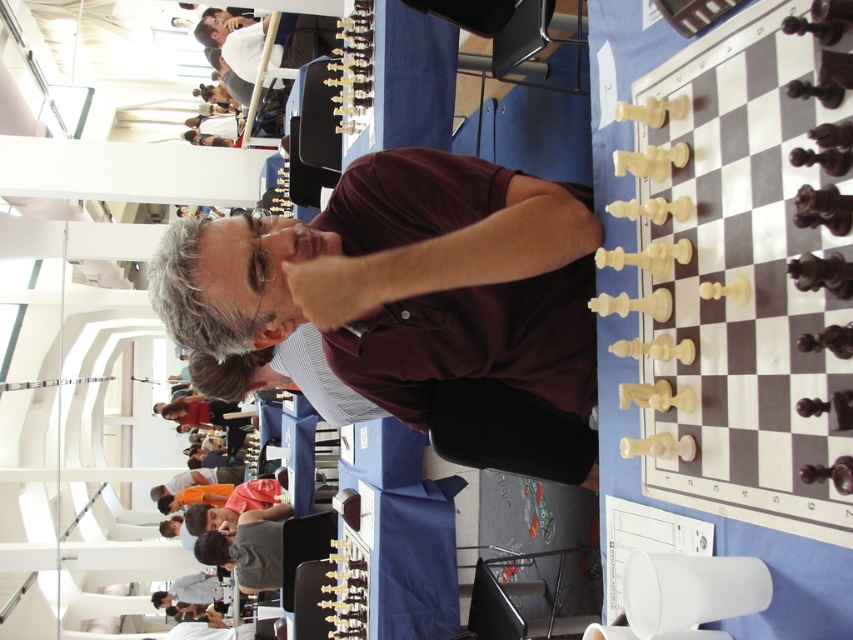
Question: Among these objects, which one is farthest from the camera?

Choices:
 (A) matte black chess set at upper center
 (B) maroon shirt at center

Answer: (A)

Question: Does maroon shirt at center have a larger size compared to matte black chess set at upper center?

Choices:
 (A) yes
 (B) no

Answer: (A)

Question: Is maroon shirt at center positioned in front of matte black chess set at upper center?

Choices:
 (A) no
 (B) yes

Answer: (B)

Question: Considering the relative positions of maroon shirt at center and matte black chess set at upper center in the image provided, where is maroon shirt at center located with respect to matte black chess set at upper center?

Choices:
 (A) below
 (B) above

Answer: (A)

Question: Which point is closer to the camera?

Choices:
 (A) maroon shirt at center
 (B) matte black chess set at upper center

Answer: (A)